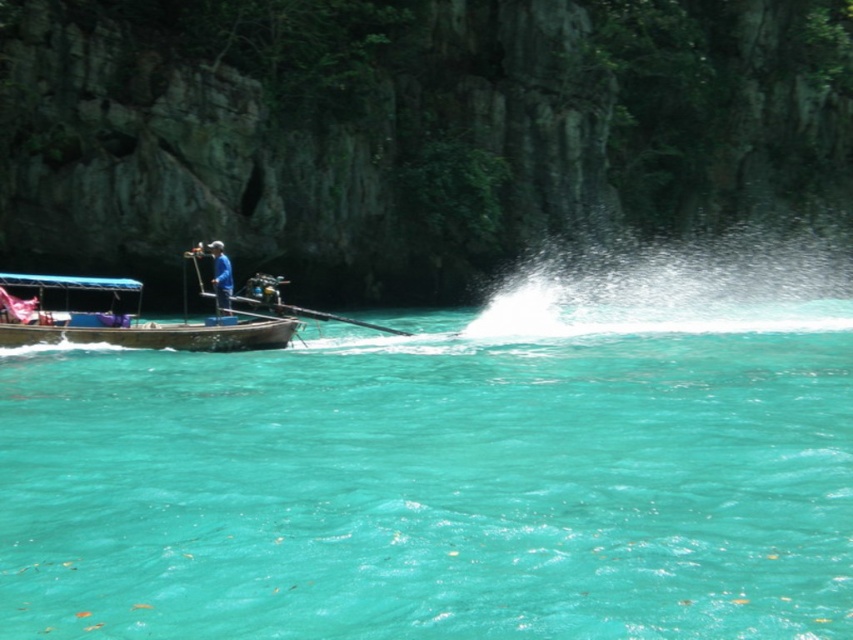
Which is below, turquoise clear water at lower left or brown wooden boat at left?

turquoise clear water at lower left is below.

Which is more to the right, turquoise clear water at lower left or brown wooden boat at left?

turquoise clear water at lower left is more to the right.

The height and width of the screenshot is (640, 853). Find the location of `turquoise clear water at lower left`. turquoise clear water at lower left is located at coordinates (440, 481).

Does brown wooden boat at left appear under blue fabric boat at left?

Yes.

Is brown wooden boat at left smaller than blue fabric boat at left?

Incorrect, brown wooden boat at left is not smaller in size than blue fabric boat at left.

Does point (51, 337) come behind point (212, 282)?

No, (51, 337) is closer to viewer.

This screenshot has height=640, width=853. What are the coordinates of `brown wooden boat at left` in the screenshot? It's located at (131, 321).

Is turquoise clear water at lower left in front of blue fabric boat at left?

Yes, it is.

Can you confirm if turquoise clear water at lower left is positioned to the left of blue fabric boat at left?

Incorrect, turquoise clear water at lower left is not on the left side of blue fabric boat at left.

You are a GUI agent. You are given a task and a screenshot of the screen. Output one action in this format:
    pyautogui.click(x=<x>, y=<y>)
    Task: Click on the turquoise clear water at lower left
    
    Given the screenshot: What is the action you would take?
    pyautogui.click(x=440, y=481)